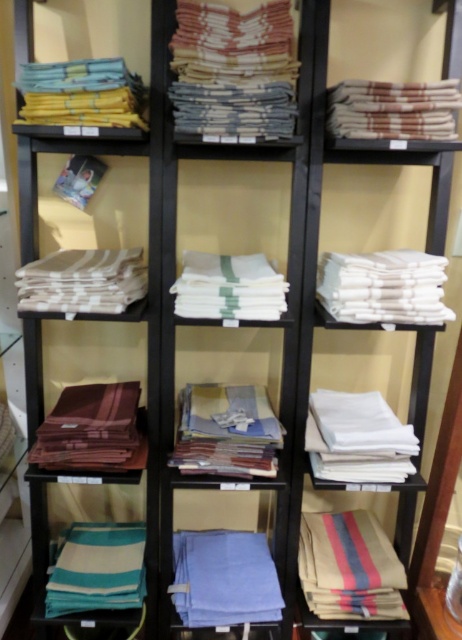
Question: Does striped cotton napkin at center appear under striped cotton towel at lower center?

Choices:
 (A) no
 (B) yes

Answer: (A)

Question: Among these points, which one is farthest from the camera?

Choices:
 (A) (222, 593)
 (B) (249, 106)
 (C) (97, 301)

Answer: (A)

Question: Is the position of striped cotton napkin at center less distant than that of striped cotton towel at lower center?

Choices:
 (A) no
 (B) yes

Answer: (B)

Question: Does blue cotton cloth at center appear under white cotton napkin at left?

Choices:
 (A) yes
 (B) no

Answer: (A)

Question: Which point appears closest to the camera in this image?

Choices:
 (A) (316, 598)
 (B) (376, 451)
 (C) (66, 582)

Answer: (B)

Question: Which point is closer to the camera taking this photo?

Choices:
 (A) (184, 42)
 (B) (249, 584)
 (C) (85, 595)

Answer: (A)